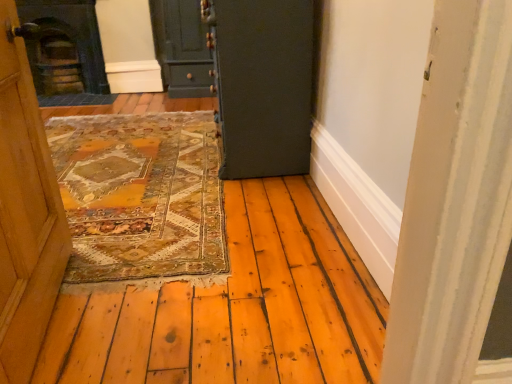
Image resolution: width=512 pixels, height=384 pixels. What do you see at coordinates (64, 52) in the screenshot?
I see `dark gray stone fireplace at upper left` at bounding box center [64, 52].

Find the location of a particular element. This screenshot has height=384, width=512. dark gray stone fireplace at upper left is located at coordinates (64, 52).

Is dark green wood at center, acting as the first door starting from the right, not within dark gray stone fireplace at upper left?

Yes, dark green wood at center, acting as the first door starting from the right, is located beyond the bounds of dark gray stone fireplace at upper left.

In the scene shown: Does dark green wood at center, the second door viewed from the left, come behind dark gray stone fireplace at upper left?

That is False.

Does dark green wood at center, the second door viewed from the left, have a larger size compared to dark gray stone fireplace at upper left?

Yes, dark green wood at center, the second door viewed from the left, is bigger than dark gray stone fireplace at upper left.

Is dark green wood at center, acting as the first door starting from the right, taller or shorter than dark gray stone fireplace at upper left?

Clearly, dark green wood at center, acting as the first door starting from the right, is shorter compared to dark gray stone fireplace at upper left.

How many degrees apart are the facing directions of dark green wood at center, the second door viewed from the left, and matte dark green cabinet at upper center, placed as the second door when sorted from right to left?

dark green wood at center, the second door viewed from the left, and matte dark green cabinet at upper center, placed as the second door when sorted from right to left, are facing 89.9 degrees away from each other.

Would you say dark green wood at center, acting as the first door starting from the front, is inside or outside matte dark green cabinet at upper center, which is the second door in front-to-back order?

dark green wood at center, acting as the first door starting from the front, exists outside the volume of matte dark green cabinet at upper center, which is the second door in front-to-back order.

How far apart are dark green wood at center, the second door viewed from the left, and matte dark green cabinet at upper center, which ranks as the 1th door in left-to-right order?

dark green wood at center, the second door viewed from the left, and matte dark green cabinet at upper center, which ranks as the 1th door in left-to-right order, are 6.37 feet apart from each other.

Is dark green wood at center, the second door from the back, looking in the opposite direction of matte dark green cabinet at upper center, acting as the 1th door starting from the back?

dark green wood at center, the second door from the back, does not have its back to matte dark green cabinet at upper center, acting as the 1th door starting from the back.

Considering the relative sizes of matte dark green cabinet at upper center, acting as the 1th door starting from the back, and dark green wood at center, acting as the first door starting from the right, in the image provided, is matte dark green cabinet at upper center, acting as the 1th door starting from the back, wider than dark green wood at center, acting as the first door starting from the right,?

Indeed, matte dark green cabinet at upper center, acting as the 1th door starting from the back, has a greater width compared to dark green wood at center, acting as the first door starting from the right.

Is matte dark green cabinet at upper center, placed as the second door when sorted from right to left, far from dark green wood at center, the second door from the back?

Yes, matte dark green cabinet at upper center, placed as the second door when sorted from right to left, and dark green wood at center, the second door from the back, are quite far apart.

Between matte dark green cabinet at upper center, which is the second door in front-to-back order, and dark green wood at center, the second door from the back, which one has larger size?

dark green wood at center, the second door from the back.

Is dark gray stone fireplace at upper left in front of dark green wood at center, acting as the first door starting from the right?

No, it is not.

Who is smaller, dark gray stone fireplace at upper left or dark green wood at center, the second door viewed from the left?

dark gray stone fireplace at upper left is smaller.

Can we say dark gray stone fireplace at upper left lies outside dark green wood at center, the second door viewed from the left?

Absolutely, dark gray stone fireplace at upper left is external to dark green wood at center, the second door viewed from the left.

How many degrees apart are the facing directions of dark gray stone fireplace at upper left and matte dark green cabinet at upper center, acting as the 1th door starting from the back?

The angular difference between dark gray stone fireplace at upper left and matte dark green cabinet at upper center, acting as the 1th door starting from the back, is 0.43 degrees.

The width and height of the screenshot is (512, 384). I want to click on fireplace that is below the matte dark green cabinet at upper center, placed as the second door when sorted from right to left (from the image's perspective), so click(64, 52).

Which object is more forward, dark gray stone fireplace at upper left or matte dark green cabinet at upper center, which is the second door in front-to-back order?

Positioned in front is matte dark green cabinet at upper center, which is the second door in front-to-back order.

From a real-world perspective, which object rests below the other?

From a 3D spatial view, matte dark green cabinet at upper center, which ranks as the 1th door in left-to-right order, is below.

What's the angular difference between matte dark green cabinet at upper center, placed as the second door when sorted from right to left, and dark gray stone fireplace at upper left's facing directions?

The angle between the facing direction of matte dark green cabinet at upper center, placed as the second door when sorted from right to left, and the facing direction of dark gray stone fireplace at upper left is 0.43 degrees.

Based on the photo, relative to dark gray stone fireplace at upper left, is matte dark green cabinet at upper center, which ranks as the 1th door in left-to-right order, in front or behind?

matte dark green cabinet at upper center, which ranks as the 1th door in left-to-right order, is positioned closer to the viewer than dark gray stone fireplace at upper left.

Is matte dark green cabinet at upper center, acting as the 1th door starting from the back, facing towards dark gray stone fireplace at upper left?

No, matte dark green cabinet at upper center, acting as the 1th door starting from the back, is not oriented towards dark gray stone fireplace at upper left.

The image size is (512, 384). Find the location of `door above the dark gray stone fireplace at upper left (from a real-world perspective)`. door above the dark gray stone fireplace at upper left (from a real-world perspective) is located at coordinates (263, 84).

In the image, there is a dark green wood at center, the second door from the back. Identify the location of door above it (from the image's perspective). (182, 47).

When comparing their distances from dark green wood at center, the second door from the back, does matte dark green cabinet at upper center, acting as the 1th door starting from the back, or dark gray stone fireplace at upper left seem further?

Based on the image, dark gray stone fireplace at upper left appears to be further to dark green wood at center, the second door from the back.

Looking at the image, which one is located further to matte dark green cabinet at upper center, placed as the second door when sorted from right to left, dark green wood at center, the second door viewed from the left, or dark gray stone fireplace at upper left?

Among the two, dark green wood at center, the second door viewed from the left, is located further to matte dark green cabinet at upper center, placed as the second door when sorted from right to left.

Based on the photo, looking at the image, which one is located closer to dark gray stone fireplace at upper left, matte dark green cabinet at upper center, placed as the second door when sorted from right to left, or dark green wood at center, the second door viewed from the left?

Based on the image, matte dark green cabinet at upper center, placed as the second door when sorted from right to left, appears to be nearer to dark gray stone fireplace at upper left.

In the scene shown: Which object lies nearer to the anchor point matte dark green cabinet at upper center, which is the second door in front-to-back order, dark gray stone fireplace at upper left or dark green wood at center, acting as the first door starting from the right?

Based on the image, dark gray stone fireplace at upper left appears to be nearer to matte dark green cabinet at upper center, which is the second door in front-to-back order.

From the image, which object appears to be nearer to dark gray stone fireplace at upper left, dark green wood at center, the second door from the back, or matte dark green cabinet at upper center, acting as the 1th door starting from the back?

matte dark green cabinet at upper center, acting as the 1th door starting from the back, is closer to dark gray stone fireplace at upper left.

When comparing their distances from dark green wood at center, acting as the first door starting from the front, does dark gray stone fireplace at upper left or matte dark green cabinet at upper center, which is the second door in front-to-back order, seem closer?

Among the two, matte dark green cabinet at upper center, which is the second door in front-to-back order, is located nearer to dark green wood at center, acting as the first door starting from the front.

The height and width of the screenshot is (384, 512). I want to click on door positioned between dark green wood at center, the second door viewed from the left, and dark gray stone fireplace at upper left from near to far, so click(182, 47).